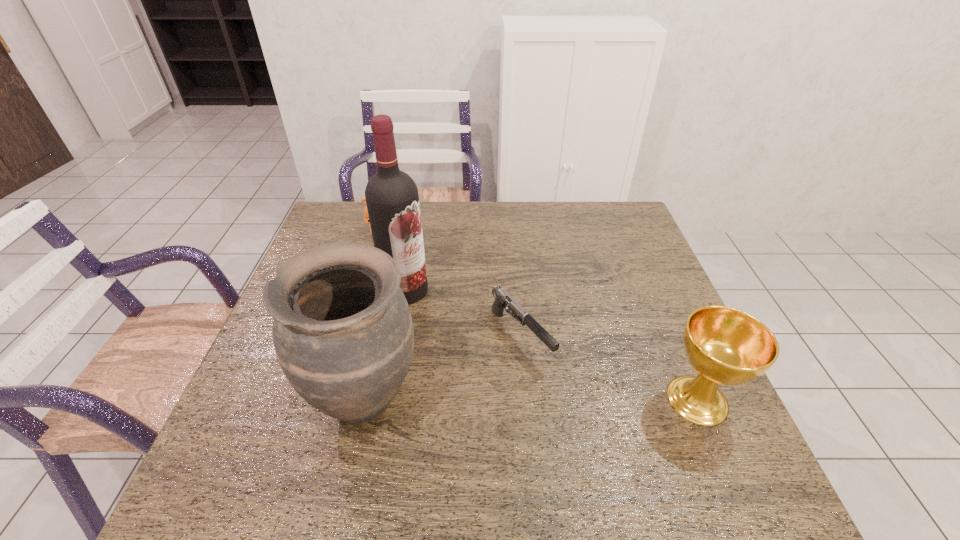
Where is `blank area located on the left of the rightmost object`? Image resolution: width=960 pixels, height=540 pixels. blank area located on the left of the rightmost object is located at coordinates (610, 400).

Locate an element on the screen. free location located 0.150m on the label of the tallest object is located at coordinates (449, 336).

Locate an element on the screen. vacant position located 0.290m on the label of the tallest object is located at coordinates 485,372.

The width and height of the screenshot is (960, 540). What are the coordinates of `free space located 0.390m on the label of the tallest object` in the screenshot? It's located at (514, 402).

The height and width of the screenshot is (540, 960). Identify the location of vacant region located 0.210m on the face of the teddy bear. (426, 274).

Where is `blank space located 0.140m on the face of the teddy bear`? blank space located 0.140m on the face of the teddy bear is located at coordinates (413, 262).

This screenshot has width=960, height=540. What are the coordinates of `free spot located on the face of the teddy bear` in the screenshot? It's located at (430, 278).

Where is `vacant space situated 0.200m at the muzzle end of the fourth object from left to right`? vacant space situated 0.200m at the muzzle end of the fourth object from left to right is located at coordinates (603, 433).

You are a GUI agent. You are given a task and a screenshot of the screen. Output one action in this format:
    pyautogui.click(x=<x>, y=<y>)
    Task: Click on the vacant area situated at the muzzle end of the fourth object from left to right
    
    Given the screenshot: What is the action you would take?
    pyautogui.click(x=603, y=433)

You are a GUI agent. You are given a task and a screenshot of the screen. Output one action in this format:
    pyautogui.click(x=<x>, y=<y>)
    Task: Click on the blank space located at the muzzle end of the fourth object from left to right
    
    Given the screenshot: What is the action you would take?
    pyautogui.click(x=603, y=433)